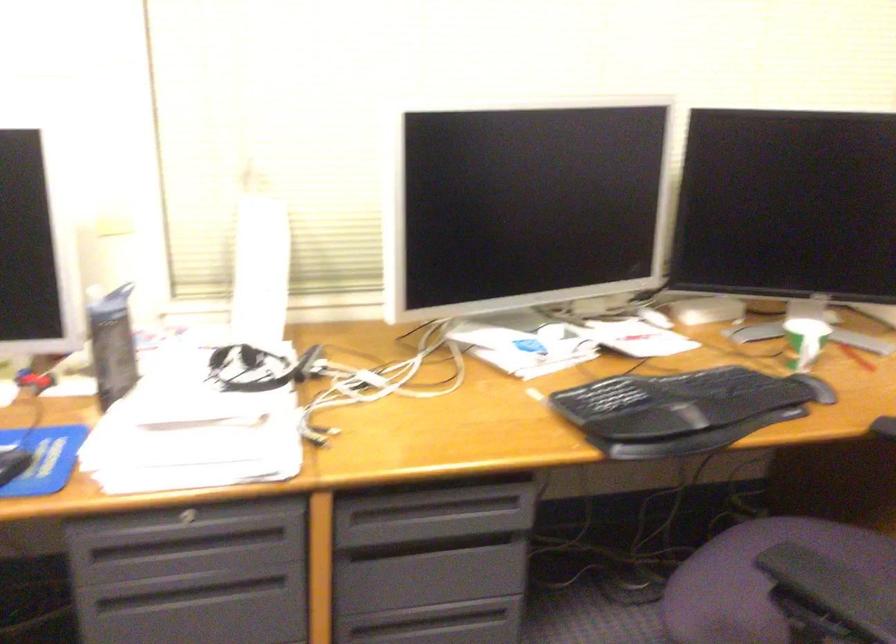
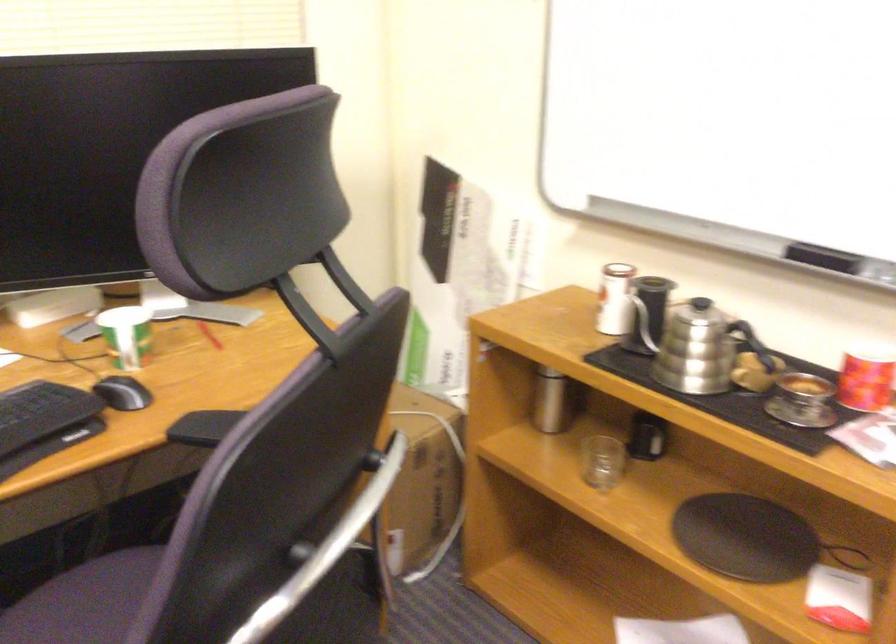
Question: Which direction would the cameraman need to move to produce the second image? Reply with the corresponding letter.

Choices:
 (A) Left
 (B) Right
 (C) Forward
 (D) Backward

Answer: (B)